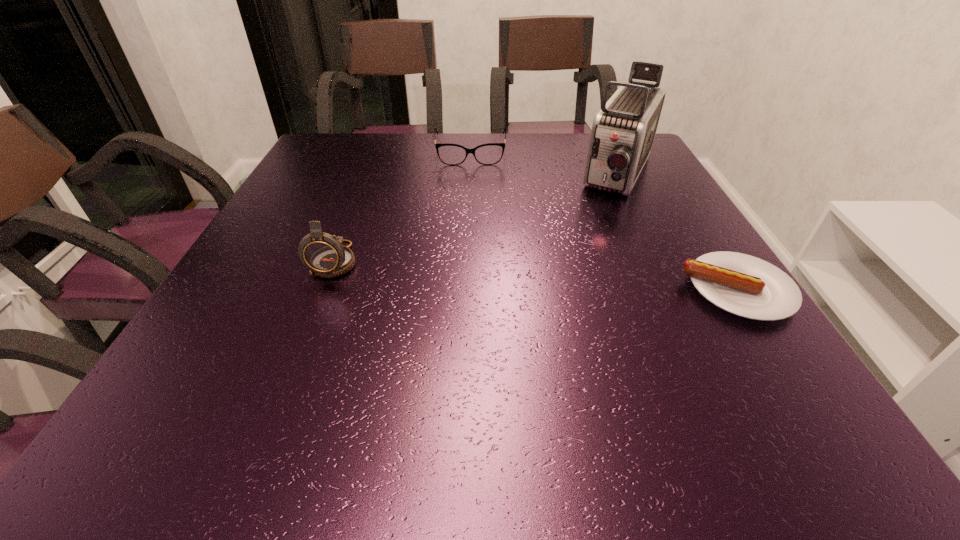
Find the location of a particular element. The width and height of the screenshot is (960, 540). vacant region between the compass and the third object from right to left is located at coordinates (403, 207).

I want to click on vacant point located between the spectacles and the compass, so click(x=403, y=207).

The image size is (960, 540). Identify the location of free space that is in between the leftmost object and the camcorder. (478, 218).

Locate an element on the screen. The image size is (960, 540). free area in between the shortest object and the spectacles is located at coordinates (604, 221).

Find the location of a particular element. free space between the second tallest object and the spectacles is located at coordinates (403, 207).

Locate an element on the screen. object that stands as the second closest to the spectacles is located at coordinates (324, 254).

I want to click on object that can be found as the second closest to the sausage, so click(450, 154).

Locate an element on the screen. free space that satisfies the following two spatial constraints: 1. on the face of the compass; 2. on the right side of the shortest object is located at coordinates (324, 290).

At what (x,y) coordinates should I click in order to perform the action: click on vacant space that satisfies the following two spatial constraints: 1. on the front side of the shortest object; 2. on the left side of the third tallest object. Please return your answer as a coordinate pair (x, y). The width and height of the screenshot is (960, 540). Looking at the image, I should click on (466, 290).

Locate an element on the screen. This screenshot has width=960, height=540. vacant space that satisfies the following two spatial constraints: 1. on the front side of the camcorder; 2. on the left side of the shortest object is located at coordinates (678, 290).